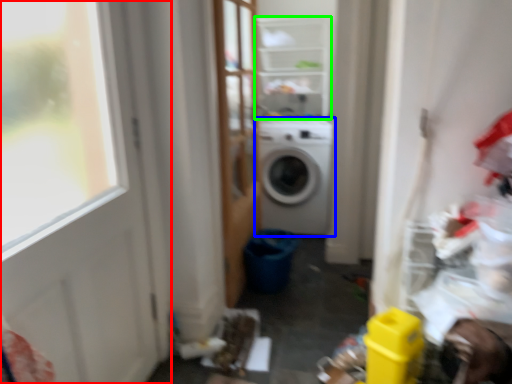
Question: Which object is positioned closest to door (highlighted by a red box)? Select from washing machine (highlighted by a blue box) and shelf (highlighted by a green box).

Choices:
 (A) washing machine
 (B) shelf

Answer: (A)